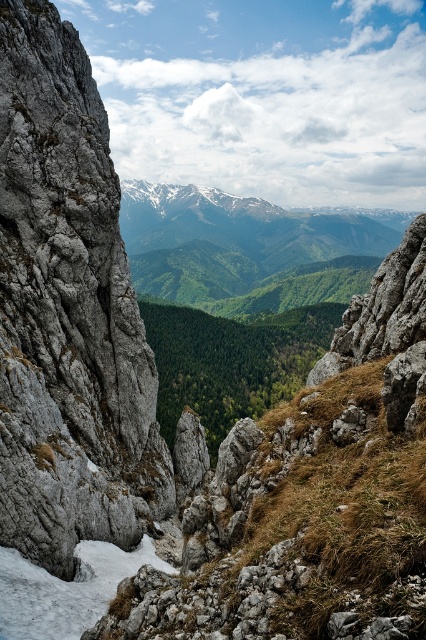
Question: Can you confirm if gray rough rock at left is smaller than white frosty snow at lower left?

Choices:
 (A) no
 (B) yes

Answer: (A)

Question: Which object is farther from the camera taking this photo?

Choices:
 (A) gray rough rock at left
 (B) white frosty snow at lower left

Answer: (A)

Question: Which of the following is the farthest from the observer?

Choices:
 (A) (81, 349)
 (B) (74, 630)

Answer: (A)

Question: Which point appears closest to the camera in this image?

Choices:
 (A) (78, 356)
 (B) (5, 588)

Answer: (B)

Question: In this image, where is gray rough rock at left located relative to white frosty snow at lower left?

Choices:
 (A) below
 (B) above

Answer: (B)

Question: Does gray rough rock at left appear under white frosty snow at lower left?

Choices:
 (A) yes
 (B) no

Answer: (B)